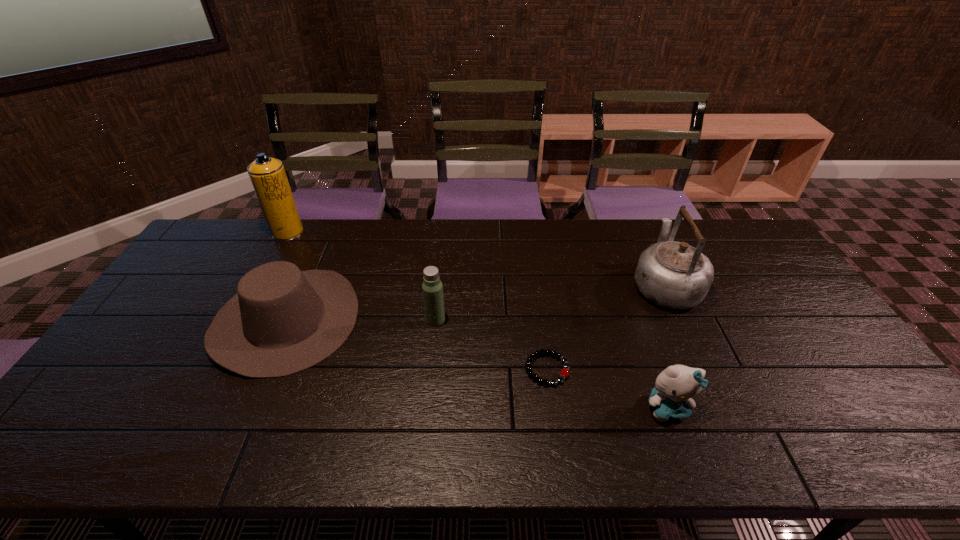
Where is `the farthest object`? Image resolution: width=960 pixels, height=540 pixels. the farthest object is located at coordinates (268, 176).

The height and width of the screenshot is (540, 960). Identify the location of aerosol can. (268, 176).

Identify the location of kettle. The image size is (960, 540). (675, 275).

I want to click on the third tallest object, so click(x=432, y=287).

The width and height of the screenshot is (960, 540). Identify the location of the third object from left to right. (432, 287).

Find the location of a particular element. This screenshot has width=960, height=540. cowboy hat is located at coordinates (282, 321).

Find the location of a particular element. This screenshot has height=540, width=960. the nearest object is located at coordinates (675, 386).

The height and width of the screenshot is (540, 960). I want to click on bracelet, so click(564, 373).

At what (x,y) coordinates should I click in order to perform the action: click on the shortest object. Please return your answer as a coordinate pair (x, y). Looking at the image, I should click on (564, 373).

Locate an element on the screen. vacant area situated on the right of the tallest object is located at coordinates (364, 233).